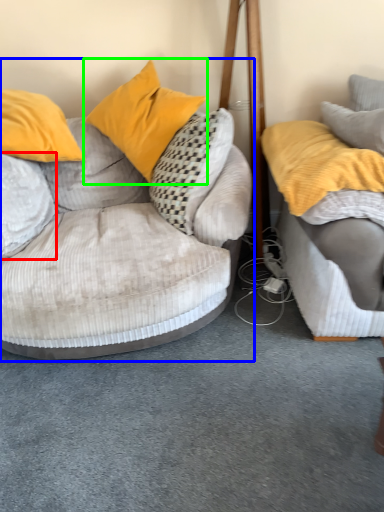
Question: Considering the real-world distances, which object is farthest from pillow (highlighted by a red box)? studio couch (highlighted by a blue box) or pillow (highlighted by a green box)?

Choices:
 (A) studio couch
 (B) pillow

Answer: (B)